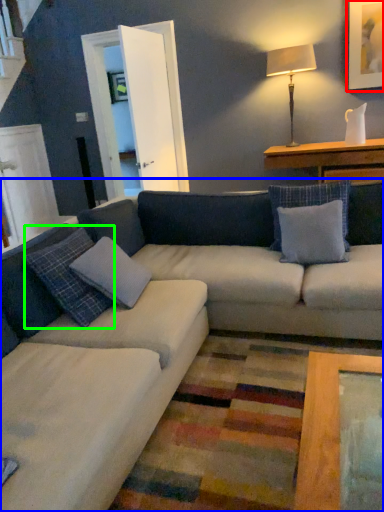
Question: Which object is positioned farthest from picture frame (highlighted by a red box)? Select from studio couch (highlighted by a blue box) and pillow (highlighted by a green box).

Choices:
 (A) studio couch
 (B) pillow

Answer: (B)